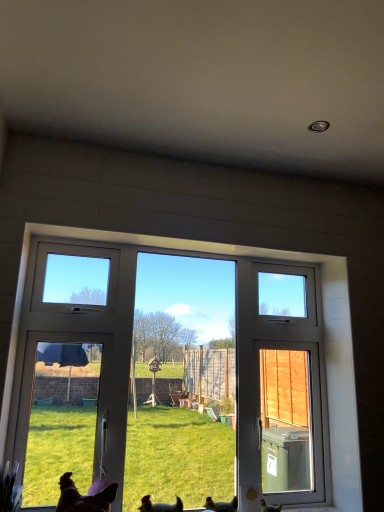
Question: Should I look upward or downward to see brown matte chicken at lower right, the 1th chicken when ordered from right to left?

Choices:
 (A) up
 (B) down

Answer: (B)

Question: Can you confirm if brown matte chicken at lower right, the 1th chicken when ordered from right to left, is thinner than brown feathered chicken at lower center, positioned as the 1th chicken in left-to-right order?

Choices:
 (A) no
 (B) yes

Answer: (B)

Question: Is brown matte chicken at lower right, the second chicken in the left-to-right sequence, with brown feathered chicken at lower center, positioned as the 1th chicken in left-to-right order?

Choices:
 (A) no
 (B) yes

Answer: (A)

Question: Is brown matte chicken at lower right, the 1th chicken when ordered from right to left, to the left of brown feathered chicken at lower center, positioned as the 1th chicken in left-to-right order, from the viewer's perspective?

Choices:
 (A) no
 (B) yes

Answer: (A)

Question: From the image's perspective, is brown matte chicken at lower right, the 1th chicken when ordered from right to left, below brown feathered chicken at lower center, positioned as the 1th chicken in left-to-right order?

Choices:
 (A) yes
 (B) no

Answer: (A)

Question: From the image's perspective, is brown matte chicken at lower right, the 1th chicken when ordered from right to left, located above brown feathered chicken at lower center, the 2th chicken from the right?

Choices:
 (A) no
 (B) yes

Answer: (A)

Question: Is brown matte chicken at lower right, the 1th chicken when ordered from right to left, not within brown fur dog at lower center, the 1th dog positioned from the right?

Choices:
 (A) no
 (B) yes

Answer: (B)

Question: Does brown matte chicken at lower right, the 1th chicken when ordered from right to left, have a larger size compared to brown fur dog at lower center, the 1th dog positioned from the right?

Choices:
 (A) yes
 (B) no

Answer: (B)

Question: Could you tell me if brown matte chicken at lower right, the second chicken in the left-to-right sequence, is facing brown fur dog at lower center, which is the second dog from left to right?

Choices:
 (A) yes
 (B) no

Answer: (B)

Question: Can you confirm if brown matte chicken at lower right, the 1th chicken when ordered from right to left, is shorter than brown fur dog at lower center, which is the second dog from left to right?

Choices:
 (A) no
 (B) yes

Answer: (B)

Question: Is the depth of brown matte chicken at lower right, the second chicken in the left-to-right sequence, less than that of brown fur dog at lower center, which is the second dog from left to right?

Choices:
 (A) no
 (B) yes

Answer: (A)

Question: Is brown matte chicken at lower right, the second chicken in the left-to-right sequence, oriented away from brown fur dog at lower center, which is the second dog from left to right?

Choices:
 (A) no
 (B) yes

Answer: (A)

Question: Does brown fur dog at lower left, the 2th dog positioned from the right, contain white plastic window at center?

Choices:
 (A) no
 (B) yes

Answer: (A)